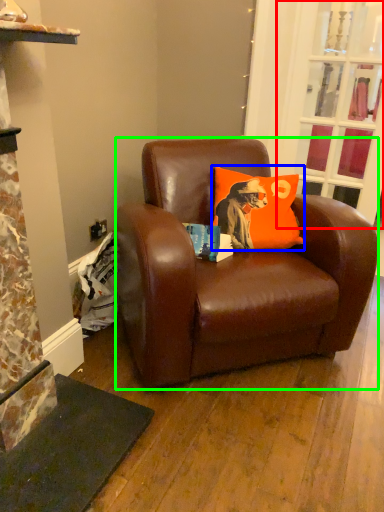
Question: Estimate the real-world distances between objects in this image. Which object is farther from glass door (highlighted by a red box), pillow (highlighted by a blue box) or studio couch (highlighted by a green box)?

Choices:
 (A) pillow
 (B) studio couch

Answer: (B)